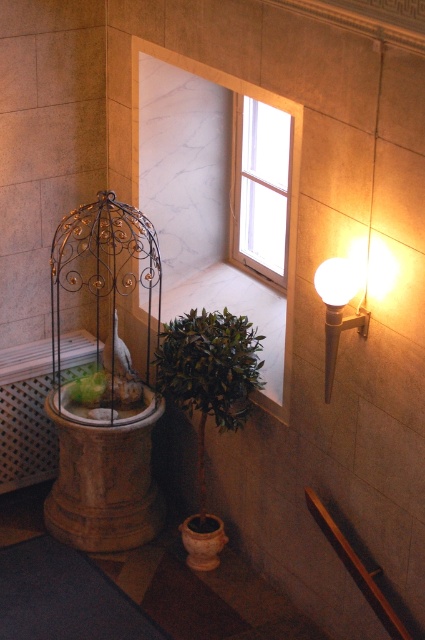
Who is taller, gold wire birdcage at left or green leafy plant at lower center?

Standing taller between the two is gold wire birdcage at left.

Describe the element at coordinates (110, 381) in the screenshot. This screenshot has height=640, width=425. I see `gold wire birdcage at left` at that location.

You are a GUI agent. You are given a task and a screenshot of the screen. Output one action in this format:
    pyautogui.click(x=<x>, y=<y>)
    Task: Click on the gold wire birdcage at left
    The image size is (425, 640).
    Given the screenshot: What is the action you would take?
    pyautogui.click(x=110, y=381)

Does clear glass window at upper center have a smaller size compared to matte terracotta pot at lower center?

No, clear glass window at upper center is not smaller than matte terracotta pot at lower center.

Who is more distant from viewer, [268,177] or [193,554]?

Positioned behind is point [268,177].

Is point (272, 173) farther from camera compared to point (207, 516)?

Yes, it is behind point (207, 516).

Find the location of a particular element. The image size is (425, 640). clear glass window at upper center is located at coordinates (260, 186).

Between green leafy plant at lower center and matte terracotta pot at lower center, which one is positioned lower?

matte terracotta pot at lower center

You are a GUI agent. You are given a task and a screenshot of the screen. Output one action in this format:
    pyautogui.click(x=<x>, y=<y>)
    Task: Click on the green leafy plant at lower center
    The height and width of the screenshot is (640, 425).
    Given the screenshot: What is the action you would take?
    pyautogui.click(x=209, y=372)